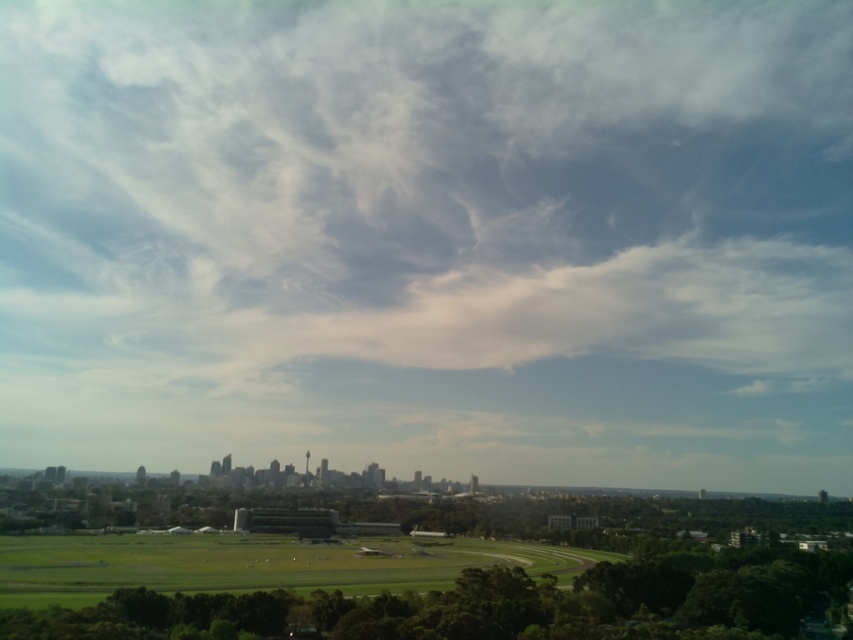
Does white cotton cloud at upper center have a greater height compared to green grassy field at lower center?

Indeed, white cotton cloud at upper center has a greater height compared to green grassy field at lower center.

Does white cotton cloud at upper center appear on the left side of green grassy field at lower center?

No, white cotton cloud at upper center is not to the left of green grassy field at lower center.

Describe the element at coordinates (422, 188) in the screenshot. The width and height of the screenshot is (853, 640). I see `white cotton cloud at upper center` at that location.

This screenshot has height=640, width=853. Find the location of `white cotton cloud at upper center`. white cotton cloud at upper center is located at coordinates (422, 188).